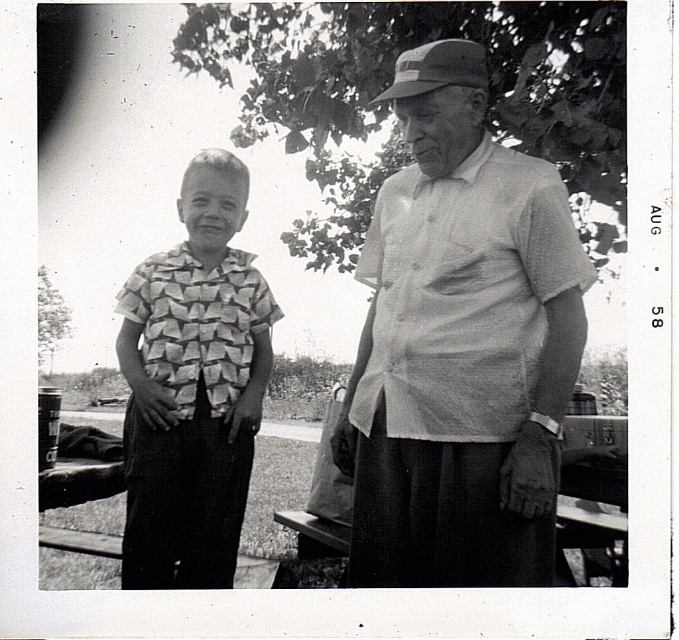
You are standing in the scene and want to take a photo of the light gray textured shirt at center and the green leafy tree at upper center. Which object is closer to the ground?

The light gray textured shirt at center is closer to the ground because it is located below the green leafy tree at upper center.

You are a photographer trying to capture the light gray textured shirt at center and the smooth bark tree at left in the same frame. Based on their positions, which object is closer to the camera?

The light gray textured shirt at center is closer to the camera because it is positioned above the smooth bark tree at left, indicating it is in a more forward plane in the image.